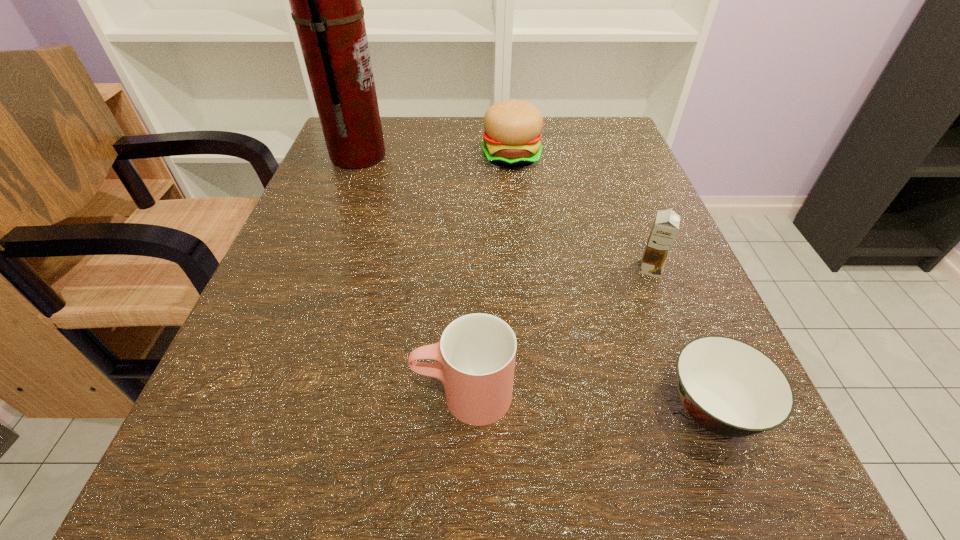
In order to click on the tallest object in this screenshot , I will do `click(325, 0)`.

Find the location of `fire extinguisher`. fire extinguisher is located at coordinates (325, 0).

In order to click on hamburger in this screenshot , I will do `click(512, 138)`.

At what (x,y) coordinates should I click in order to perform the action: click on the third nearest object. Please return your answer as a coordinate pair (x, y). Looking at the image, I should click on (666, 225).

The width and height of the screenshot is (960, 540). What are the coordinates of `cup` in the screenshot? It's located at (476, 356).

Image resolution: width=960 pixels, height=540 pixels. What are the coordinates of `soup bowl` in the screenshot? It's located at (730, 388).

Identify the location of free point located 0.050m on the side of the fire extinguisher with the handle and hose. Image resolution: width=960 pixels, height=540 pixels. (410, 156).

Locate an element on the screen. The height and width of the screenshot is (540, 960). vacant area situated 0.240m on the front of the hamburger is located at coordinates tap(521, 255).

Where is `vacant space positioned 0.330m on the front of the third nearest object`? The width and height of the screenshot is (960, 540). vacant space positioned 0.330m on the front of the third nearest object is located at coordinates (748, 516).

At what (x,y) coordinates should I click in order to perform the action: click on free space located on the side of the cup with the handle. Please return your answer as a coordinate pair (x, y). This screenshot has height=540, width=960. Looking at the image, I should click on (289, 395).